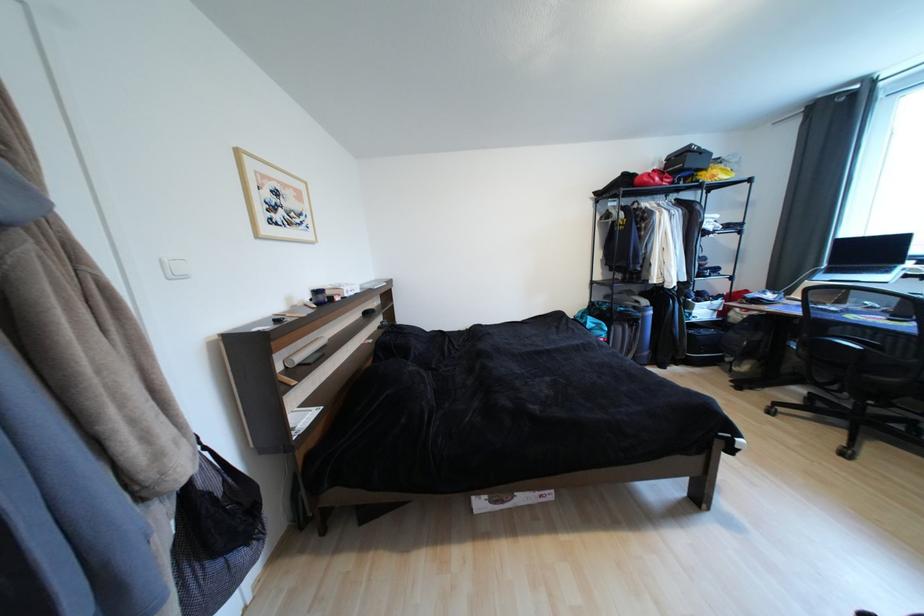
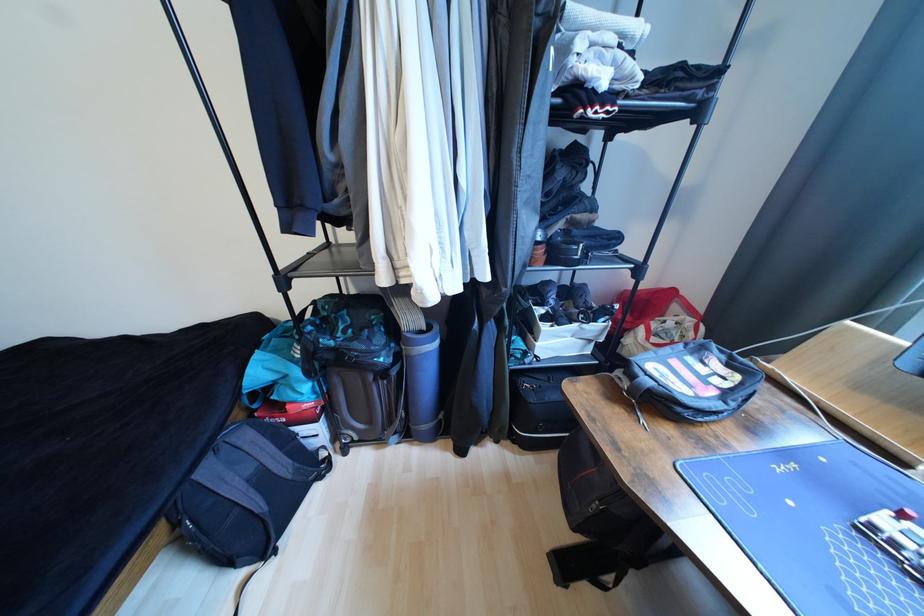
Which direction would the cameraman need to move to produce the second image?

The movement direction of the cameraman is right, forward.